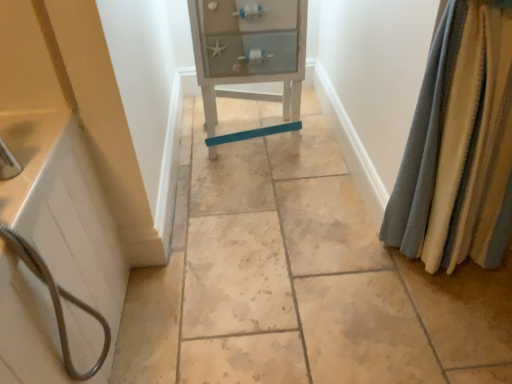
I want to click on vacant space to the left of velvet-like beige curtains at right, so click(339, 275).